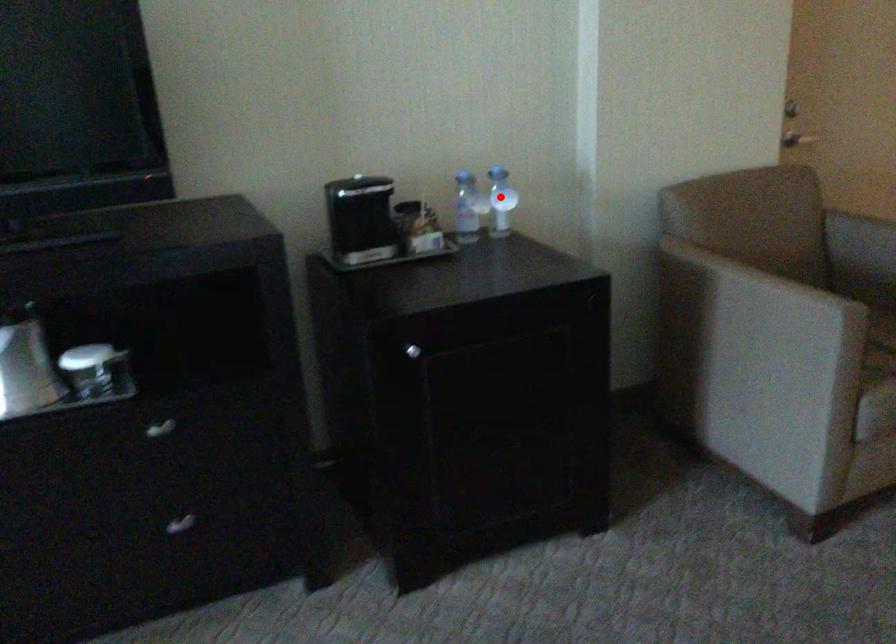
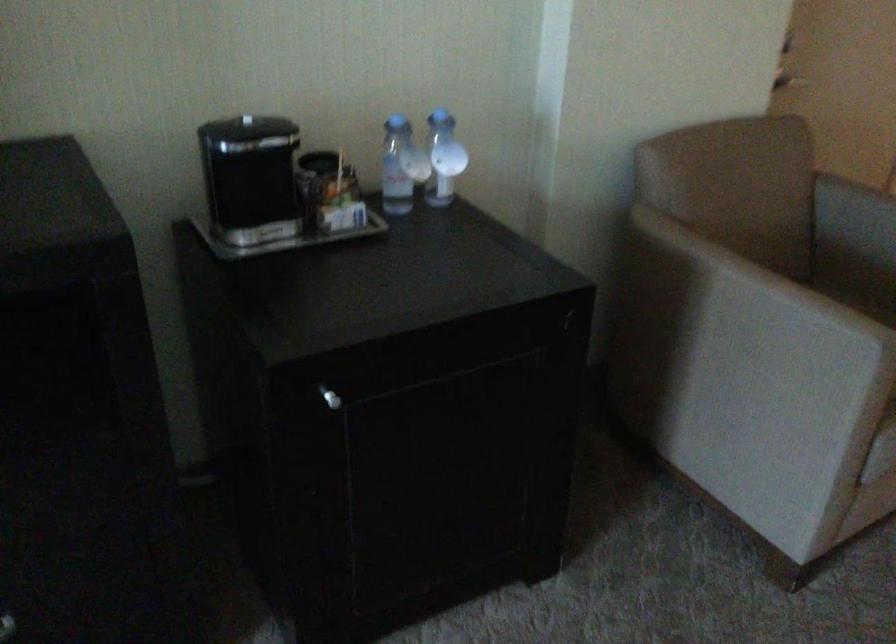
Locate, in the second image, the point that corresponds to the highlighted location in the first image.

(443, 158)